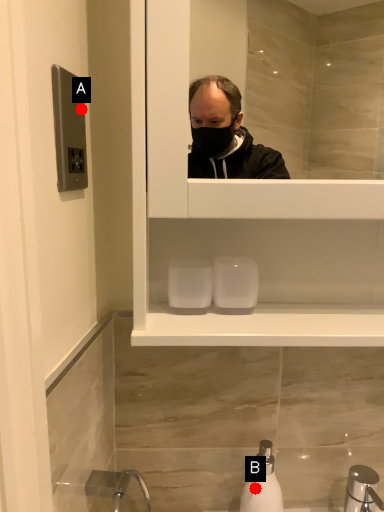
Question: Two points are circled on the image, labeled by A and B beside each circle. Among these points, which one is farthest from the camera?

Choices:
 (A) A is further
 (B) B is further

Answer: (B)